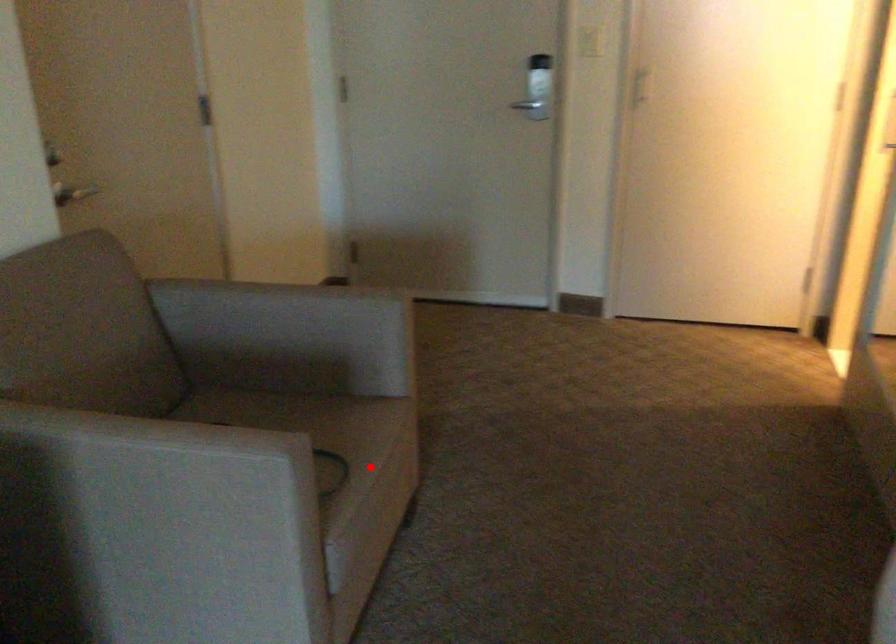
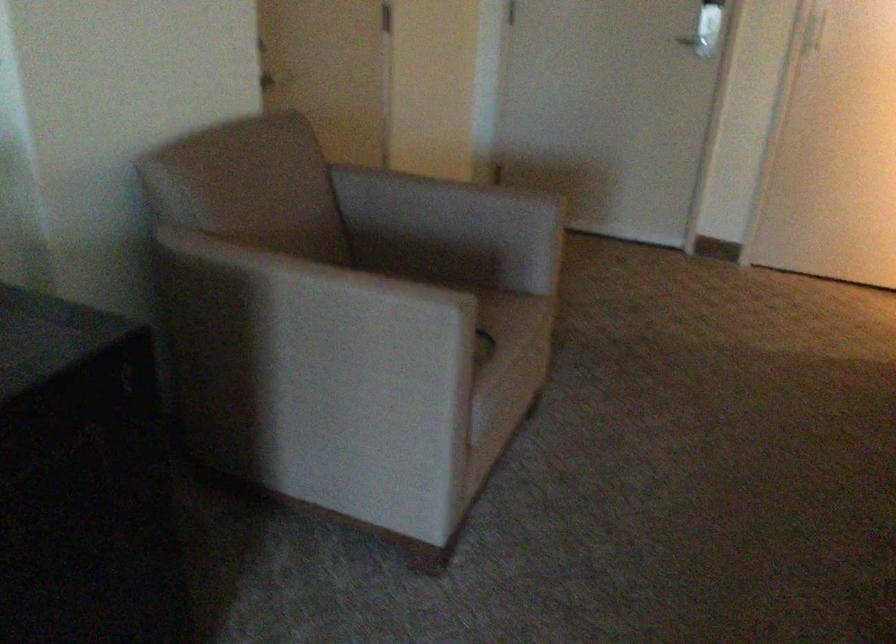
In the second image, find the point that corresponds to the highlighted location in the first image.

(513, 345)